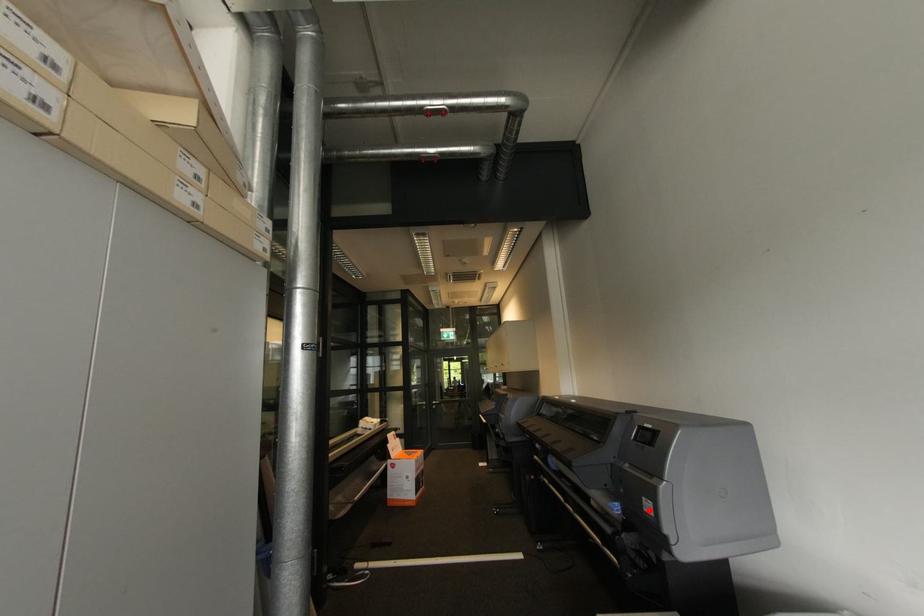
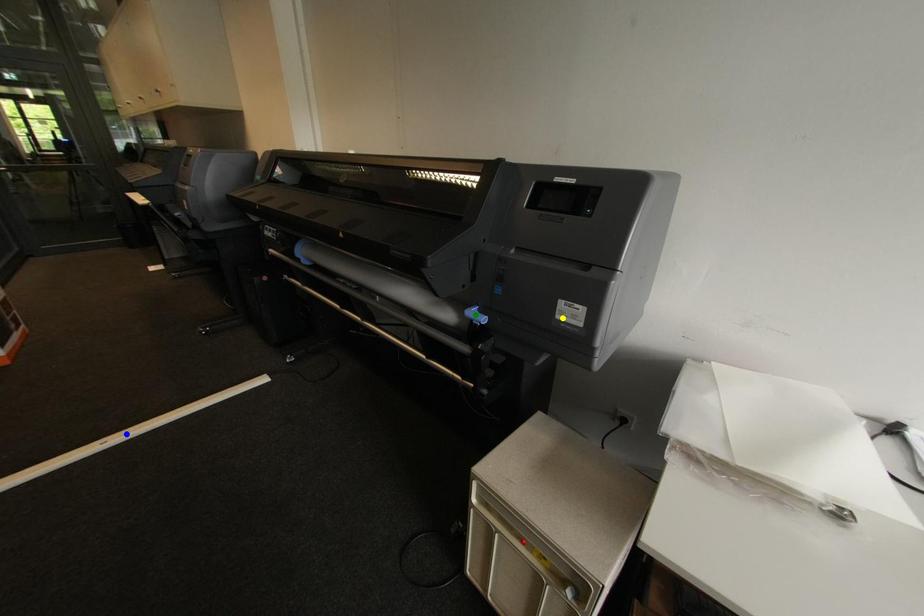
Question: I am providing you with two images of the same scene from different viewpoints. A red point is marked on the first image. You are given multiple points on the second image. In image 2, which mark is for the same physical point as the one in image 1?

Choices:
 (A) blue point
 (B) green point
 (C) yellow point

Answer: (C)